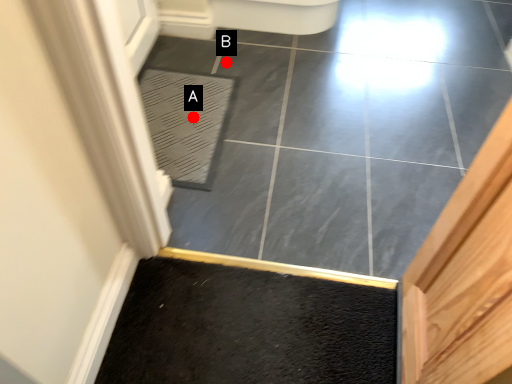
Question: Two points are circled on the image, labeled by A and B beside each circle. Which of the following is the closest to the observer?

Choices:
 (A) A is closer
 (B) B is closer

Answer: (A)